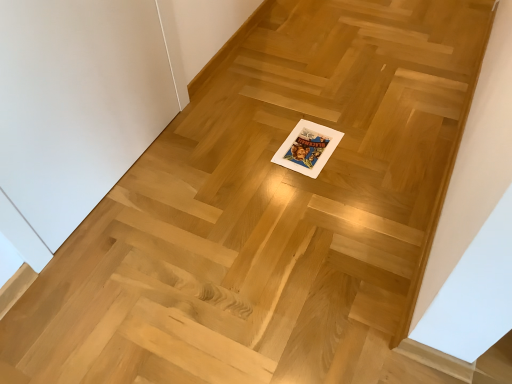
Locate an element on the screen. This screenshot has width=512, height=384. vacant space behind white paper at center is located at coordinates (303, 111).